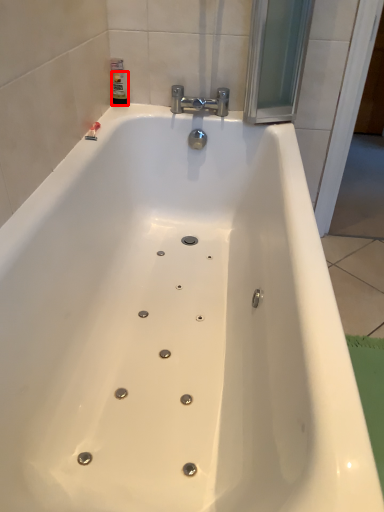
Question: From the image's perspective, where is toiletry (annotated by the red box) located relative to tap?

Choices:
 (A) below
 (B) above

Answer: (B)